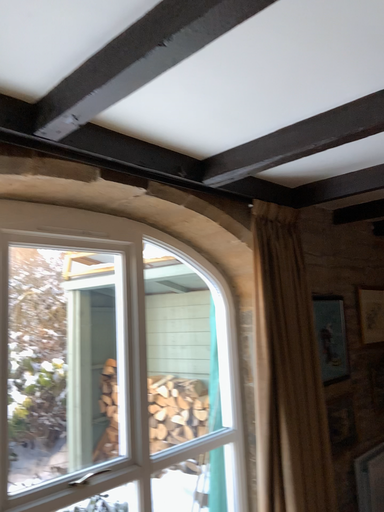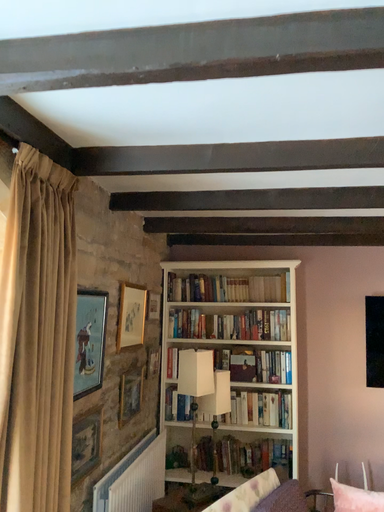
Question: Which way did the camera rotate in the video?

Choices:
 (A) rotated right
 (B) rotated left

Answer: (A)